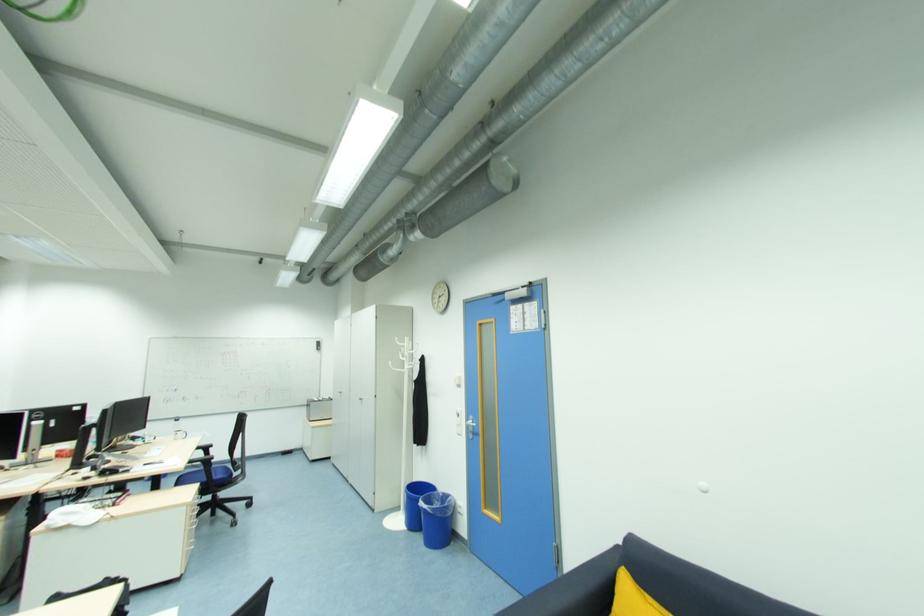
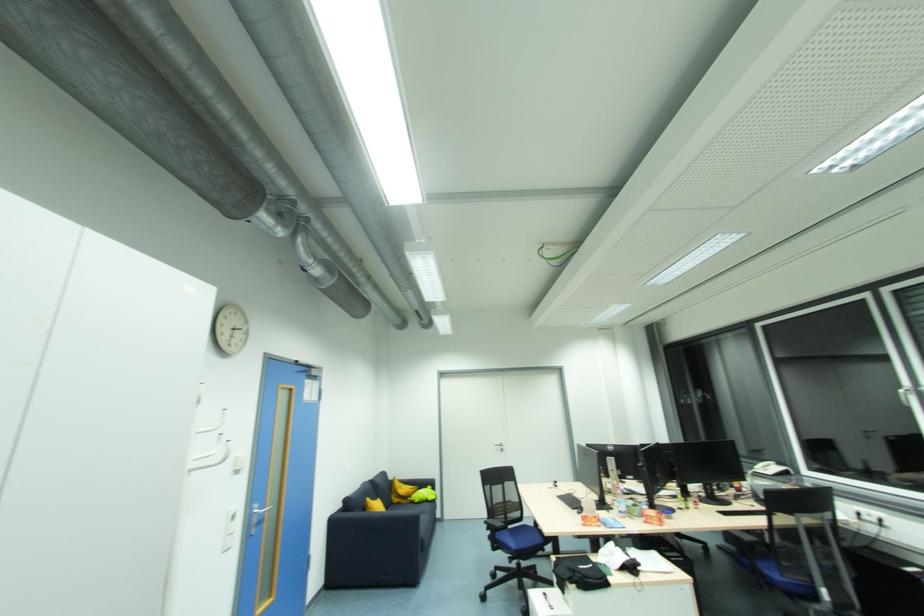
Where in the second image is the point corresponding to point 462,416 from the first image?

(236, 520)